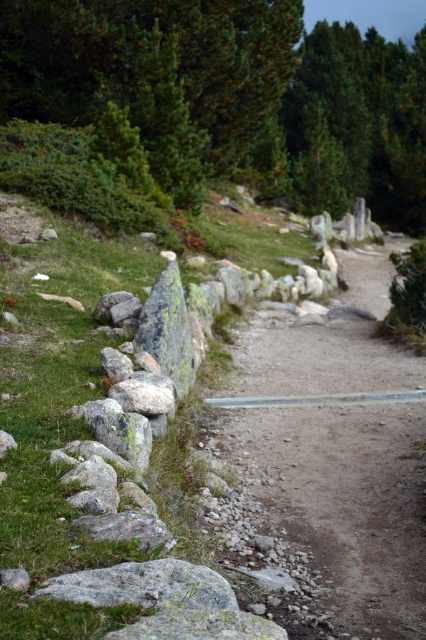
Who is more distant from viewer, (78, 1) or (322, 113)?

The point (322, 113) is behind.

The height and width of the screenshot is (640, 426). I want to click on green leafy tree at upper center, so click(241, 90).

Does green matte tree at upper center have a larger size compared to gray rough rock at lower left?

Indeed, green matte tree at upper center has a larger size compared to gray rough rock at lower left.

Is green matte tree at upper center wider than gray rough rock at lower left?

Indeed, green matte tree at upper center has a greater width compared to gray rough rock at lower left.

This screenshot has width=426, height=640. Identify the location of green matte tree at upper center. (359, 122).

Can you confirm if green leafy tree at upper center is smaller than gray rough rock at lower left?

Incorrect, green leafy tree at upper center is not smaller in size than gray rough rock at lower left.

Who is more distant from viewer, (344, 77) or (218, 579)?

The point (344, 77) is behind.

Describe the element at coordinates (241, 90) in the screenshot. I see `green leafy tree at upper center` at that location.

Where is `green leafy tree at upper center`? Image resolution: width=426 pixels, height=640 pixels. green leafy tree at upper center is located at coordinates (241, 90).